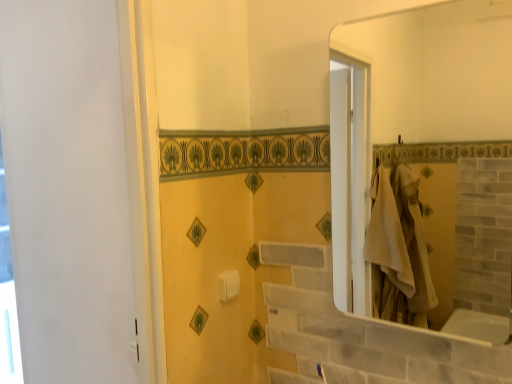
Question: Should I look upward or downward to see white glossy mirror at upper right?

Choices:
 (A) down
 (B) up

Answer: (B)

Question: Is white glossy window at left further to camera compared to white plastic towel bar at center?

Choices:
 (A) no
 (B) yes

Answer: (B)

Question: Considering the relative positions of white glossy window at left and white plastic towel bar at center in the image provided, is white glossy window at left to the left of white plastic towel bar at center from the viewer's perspective?

Choices:
 (A) yes
 (B) no

Answer: (A)

Question: From a real-world perspective, is white glossy window at left positioned over white plastic towel bar at center based on gravity?

Choices:
 (A) yes
 (B) no

Answer: (B)

Question: Is white glossy window at left bigger than white plastic towel bar at center?

Choices:
 (A) yes
 (B) no

Answer: (A)

Question: Considering the relative sizes of white glossy window at left and white plastic towel bar at center in the image provided, is white glossy window at left shorter than white plastic towel bar at center?

Choices:
 (A) yes
 (B) no

Answer: (B)

Question: Is white glossy window at left at the right side of white plastic towel bar at center?

Choices:
 (A) yes
 (B) no

Answer: (B)

Question: Does white plastic towel bar at center contain white glossy window at left?

Choices:
 (A) no
 (B) yes

Answer: (A)

Question: From a real-world perspective, is white plastic towel bar at center beneath white glossy window at left?

Choices:
 (A) no
 (B) yes

Answer: (A)

Question: Does white plastic towel bar at center have a greater height compared to white glossy window at left?

Choices:
 (A) yes
 (B) no

Answer: (B)

Question: Is white plastic towel bar at center further to the viewer compared to white glossy window at left?

Choices:
 (A) yes
 (B) no

Answer: (B)

Question: Is white plastic towel bar at center smaller than white glossy window at left?

Choices:
 (A) no
 (B) yes

Answer: (B)

Question: From the image's perspective, is white plastic towel bar at center beneath white glossy window at left?

Choices:
 (A) yes
 (B) no

Answer: (B)

Question: From a real-world perspective, is white glossy mirror at upper right physically above white glossy window at left?

Choices:
 (A) no
 (B) yes

Answer: (B)